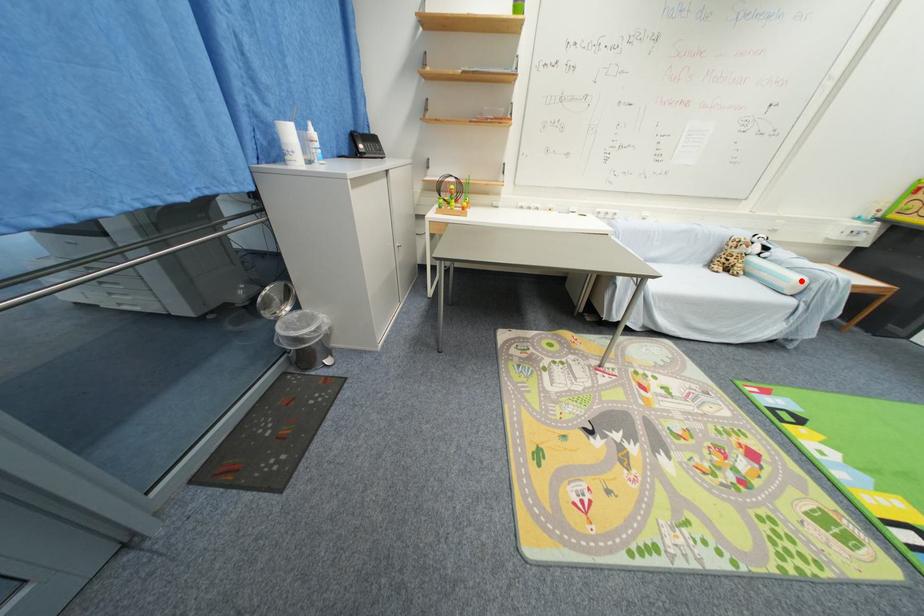
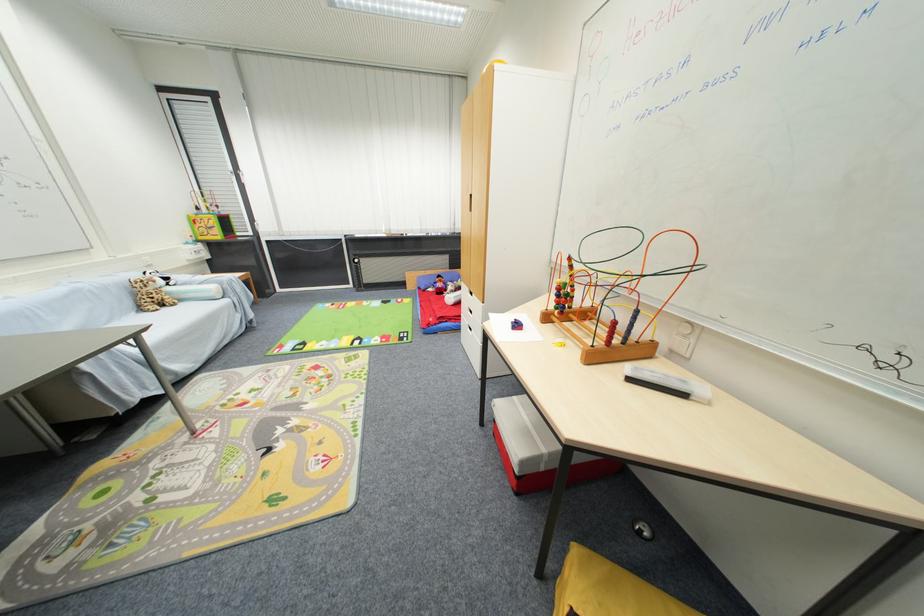
Question: A red point is marked in image1. In image2, is the corresponding 3D point closer to the camera or farther? Reply with the corresponding letter.

Choices:
 (A) The corresponding 3D point is closer.
 (B) The corresponding 3D point is farther.

Answer: (A)